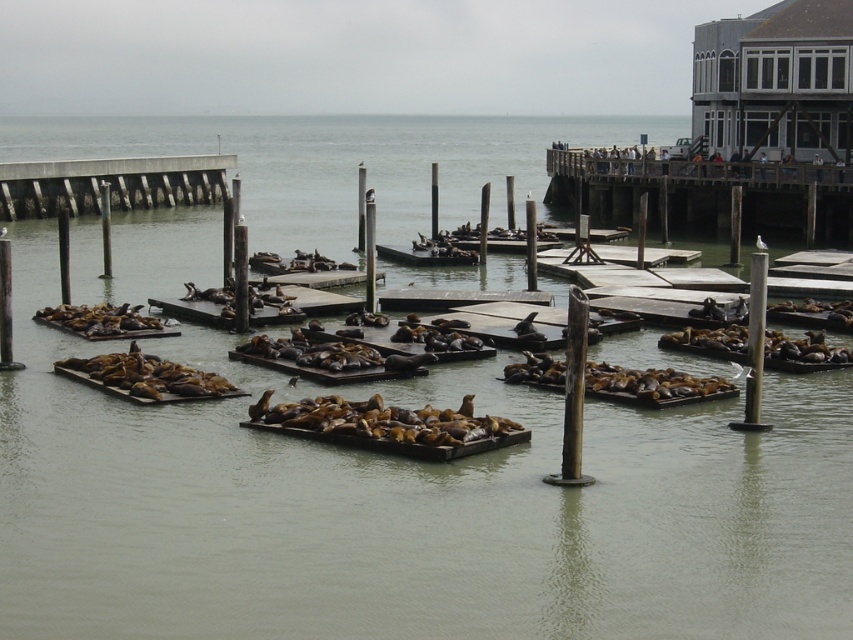
Question: Which object is closer to the camera taking this photo?

Choices:
 (A) wooden planks at left
 (B) wooden dock at upper right

Answer: (B)

Question: Is wooden dock at upper right further to the viewer compared to wooden planks at left?

Choices:
 (A) no
 (B) yes

Answer: (A)

Question: Can you confirm if wooden dock at upper right is smaller than wooden planks at left?

Choices:
 (A) no
 (B) yes

Answer: (A)

Question: Is wooden dock at upper right bigger than wooden planks at left?

Choices:
 (A) no
 (B) yes

Answer: (B)

Question: Which of the following is the closest to the observer?

Choices:
 (A) wooden dock at upper right
 (B) wooden planks at left

Answer: (A)

Question: Which point is closer to the camera taking this photo?

Choices:
 (A) (671, 198)
 (B) (26, 180)

Answer: (A)